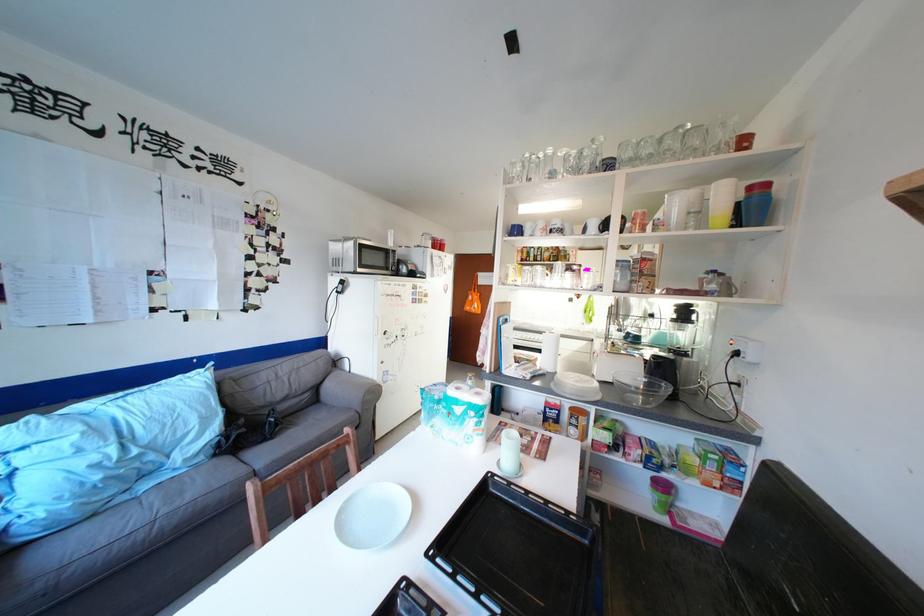
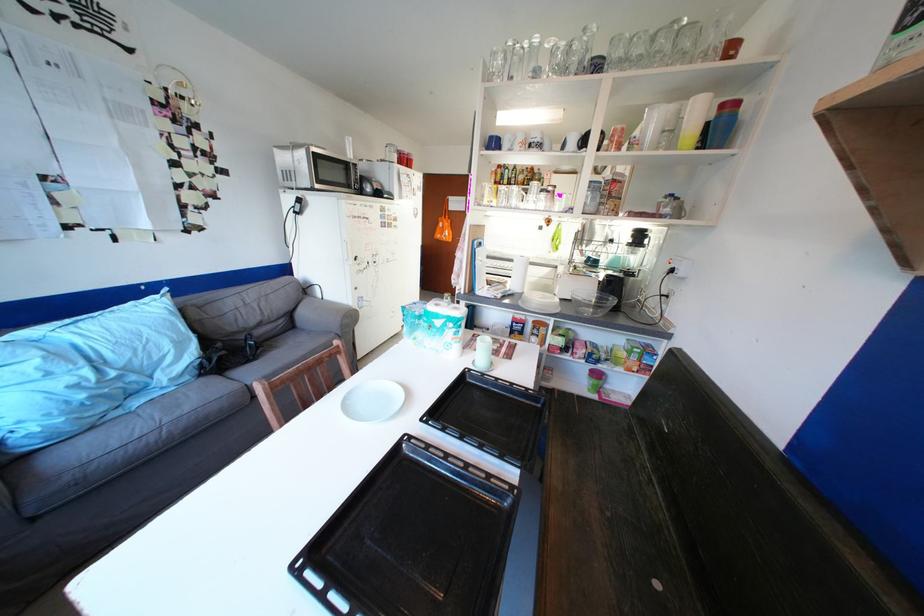
Where in the second image is the point corresponding to [591,289] from the first image?

(564, 212)